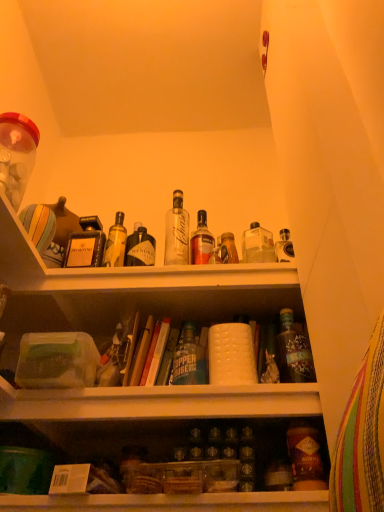
Question: From the image's perspective, is hardcover book at center, positioned as the 2th book in left-to-right order, located above or below matte brown bottle at lower right, acting as the 2th bottle starting from the right?

Choices:
 (A) below
 (B) above

Answer: (B)

Question: Is hardcover book at center, positioned as the 2th book in left-to-right order, taller or shorter than matte brown bottle at lower right, arranged as the fourth bottle when viewed from the left?

Choices:
 (A) short
 (B) tall

Answer: (B)

Question: Which is farther from the matte brown bottle at lower right, acting as the 2th bottle starting from the right?

Choices:
 (A) hardcover book at center, positioned as the 2th book in left-to-right order
 (B) green glass bottle at center, the 4th bottle when ordered from right to left
 (C) translucent glass bottle at center right, the fifth bottle positioned from the left
 (D) clear glass bottle at center, placed as the first bottle when sorted from left to right
 (E) hardcover book at center, the 2th book viewed from the right

Answer: (D)

Question: Estimate the real-world distances between objects in this image. Which object is closer to the matte brown bottle at lower right, acting as the 2th bottle starting from the right?

Choices:
 (A) hardcover book at center, which appears as the 1th book when viewed from the left
 (B) translucent glass bottle at center, the third bottle in the left-to-right sequence
 (C) hardcover book at center, the 1th book viewed from the right
 (D) green glass bottle at center, the 2th bottle when ordered from left to right
 (E) clear glass bottle at center, which ranks as the 5th bottle in right-to-left order

Answer: (D)